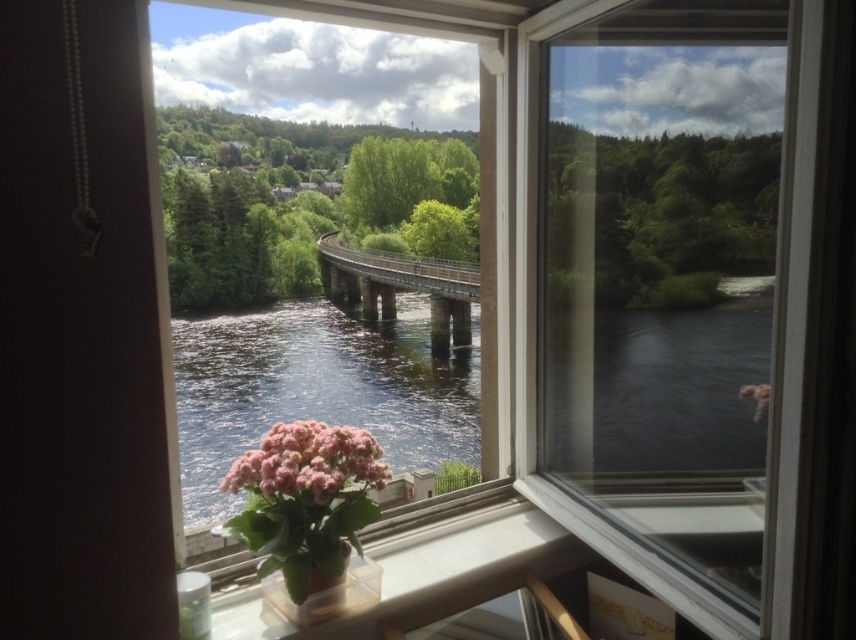
Is clear plastic container at lower center to the right of pink matte flower at lower center from the viewer's perspective?

Indeed, clear plastic container at lower center is positioned on the right side of pink matte flower at lower center.

Between point (355, 627) and point (352, 429), which one is positioned in front?

Point (352, 429) is more forward.

Image resolution: width=856 pixels, height=640 pixels. Find the location of `clear plastic container at lower center`. clear plastic container at lower center is located at coordinates (425, 573).

Is point (702, 440) closer to camera compared to point (345, 476)?

No, it is behind (345, 476).

Does dark reflective water at center have a smaller size compared to pink matte flower at lower center?

Actually, dark reflective water at center might be larger than pink matte flower at lower center.

At what (x,y) coordinates should I click in order to perform the action: click on dark reflective water at center. Please return your answer as a coordinate pair (x, y). Image resolution: width=856 pixels, height=640 pixels. Looking at the image, I should click on (316, 388).

Identify the location of dark reflective water at center. The height and width of the screenshot is (640, 856). [316, 388].

Can you confirm if pink matte flower at lower center is wider than green matte vase at lower center?

Correct, the width of pink matte flower at lower center exceeds that of green matte vase at lower center.

Is point (253, 460) farther from camera compared to point (349, 609)?

No, (253, 460) is closer to viewer.

Is point (296, 476) behind point (308, 616)?

No.

The width and height of the screenshot is (856, 640). I want to click on pink matte flower at lower center, so click(x=308, y=461).